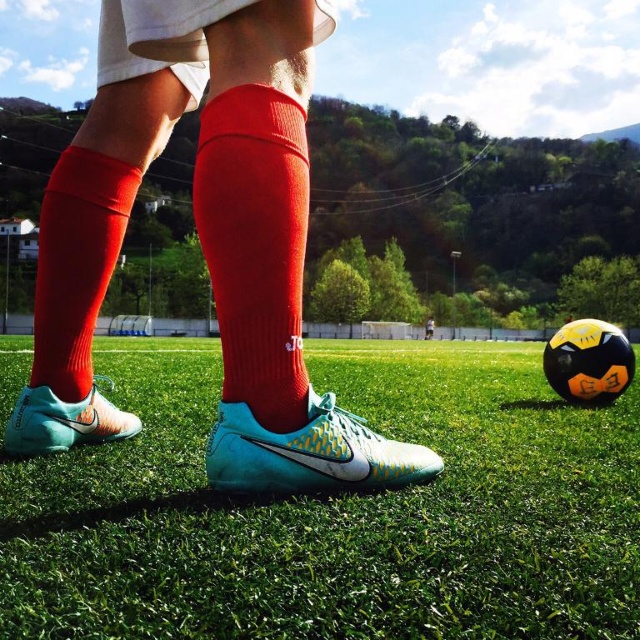
You are standing at the point labeled as point (205,196) on the soccer field. You want to kick a soccer ball to your teammate who is standing 5 feet away from you in the direction opposite to the hills. Will your teammate be able to receive the ball if you kick it with a force that can travel 6 feet?

The distance between you and your teammate is 5 feet, and the ball can travel 6 feet. Since 5 feet is less than 6 feet, your teammate will be able to receive the ball.

In the scene shown: You are a photographer taking a closeup shot of the soccer player. Which object would appear larger in your photo, the knitted red sock at center or the teal matte nike cleat at center?

The knitted red sock at center would appear larger in the photo because it is closer to the viewer than the teal matte nike cleat at center.

You are a soccer player trying to kick the ball. The ball is located at the position of the teal matte nike cleat at center. Your red knit sock at lower left is your left sock. Can you kick the ball with your right foot without moving your left sock?

The red knit sock at lower left is 26.87 inches away from the teal matte nike cleat at center. Since the distance is about 2.24 feet, you can kick the ball with your right foot without moving your left sock as the distance is manageable for a soccer kick.